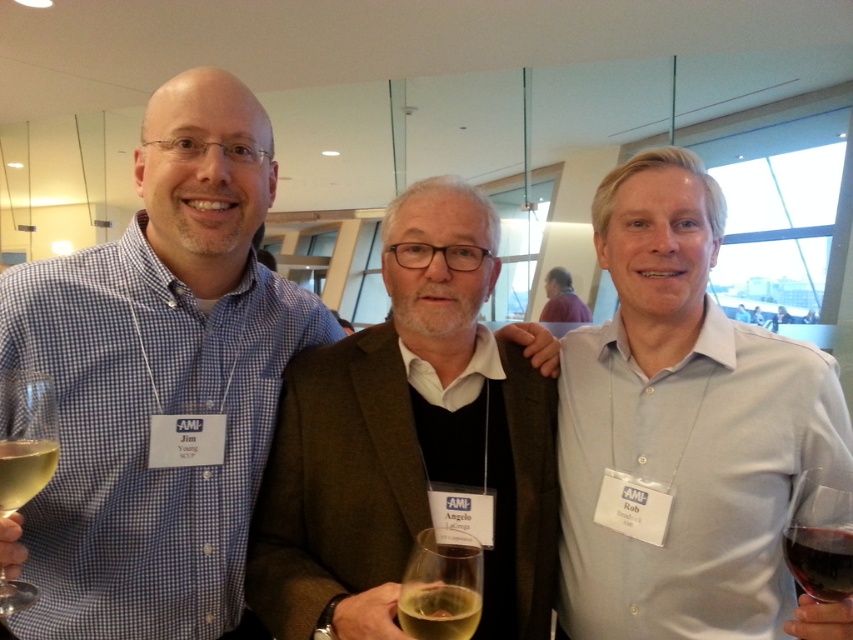
Question: Which point is farther to the camera?

Choices:
 (A) (451, 592)
 (B) (792, 572)

Answer: (B)

Question: Which of the following is the closest to the observer?

Choices:
 (A) clear glass wine glass at left
 (B) translucent glass wine at left
 (C) red glass wine at lower right

Answer: (B)

Question: Can you confirm if light blue shirt at center is positioned below dark purple sweater at center?

Choices:
 (A) yes
 (B) no

Answer: (A)

Question: Where is translucent glass at center located in relation to translucent glass wine at left in the image?

Choices:
 (A) left
 (B) right

Answer: (B)

Question: Does clear glass wine glass at left lie in front of translucent glass wine at left?

Choices:
 (A) yes
 (B) no

Answer: (B)

Question: Which object is the farthest from the blue checkered shirt at left?

Choices:
 (A) translucent glass wine at right
 (B) brown woolen jacket at center

Answer: (A)